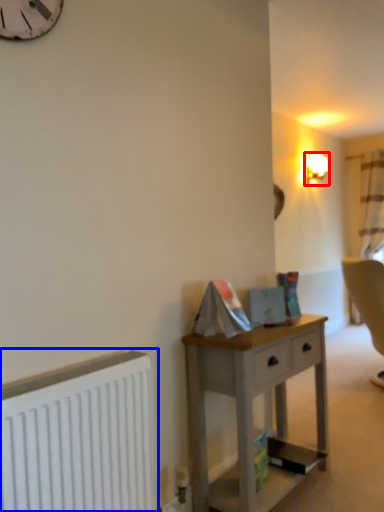
Question: Which object is further to the camera taking this photo, lamp (highlighted by a red box) or radiator (highlighted by a blue box)?

Choices:
 (A) lamp
 (B) radiator

Answer: (A)